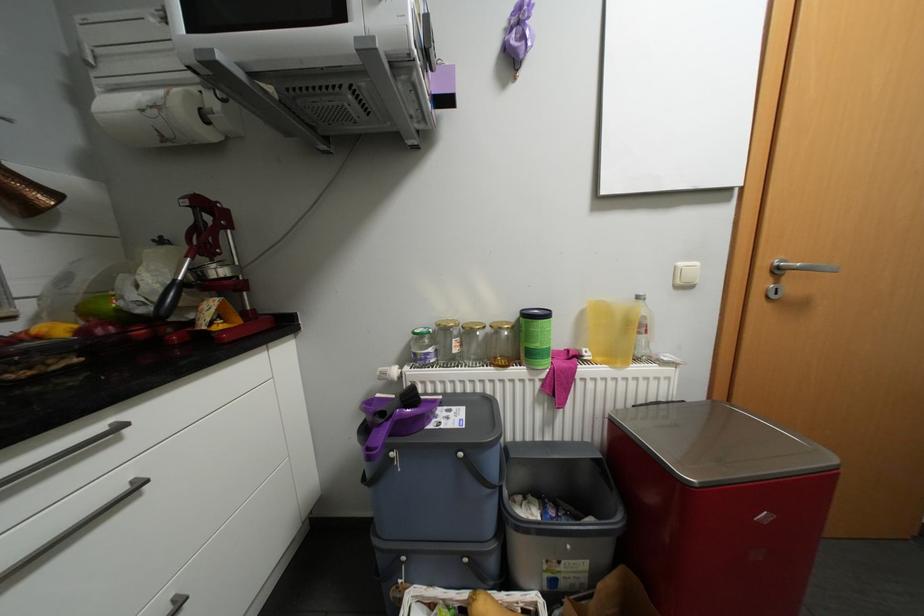
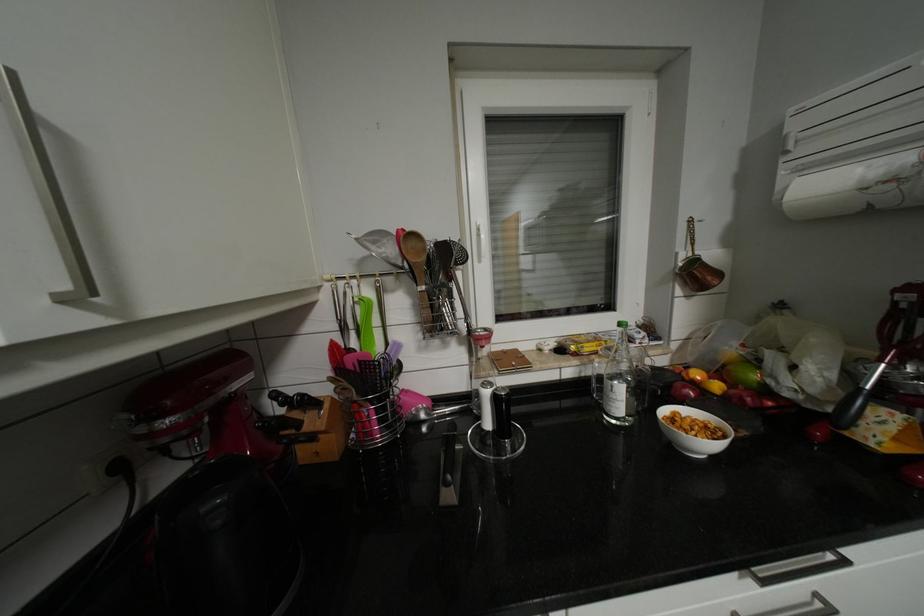
Where in the second image is the point corresponding to (x=69, y=329) from the first image?

(724, 386)